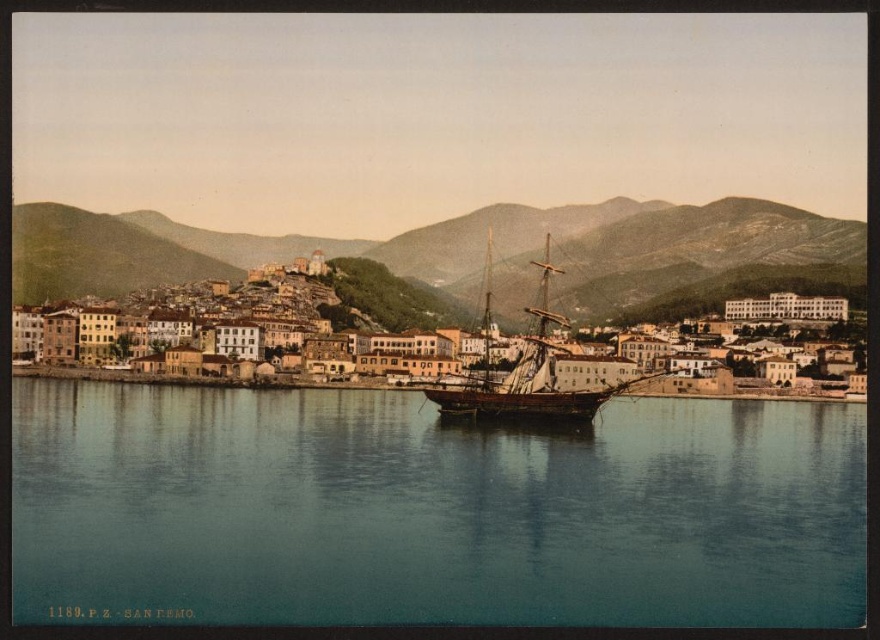
Question: Which point is closer to the camera?

Choices:
 (A) (721, 211)
 (B) (437, 500)

Answer: (B)

Question: Is blue water at center positioned before rocky brown mountain at center?

Choices:
 (A) yes
 (B) no

Answer: (A)

Question: Which point appears closest to the camera in this image?

Choices:
 (A) (541, 339)
 (B) (445, 289)

Answer: (A)

Question: Among these points, which one is nearest to the camera?

Choices:
 (A) (798, 554)
 (B) (497, 230)
 (C) (573, 355)
 (D) (792, 301)

Answer: (A)

Question: Is matte yellow building at center above wooden ship at center?

Choices:
 (A) no
 (B) yes

Answer: (A)

Question: Can you confirm if rocky brown mountain at center is thinner than wooden ship at center?

Choices:
 (A) yes
 (B) no

Answer: (B)